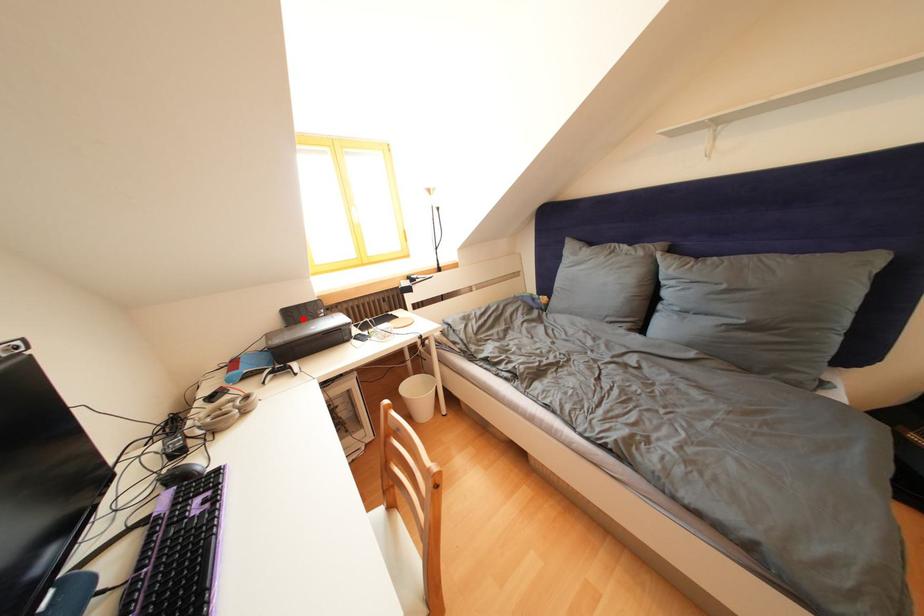
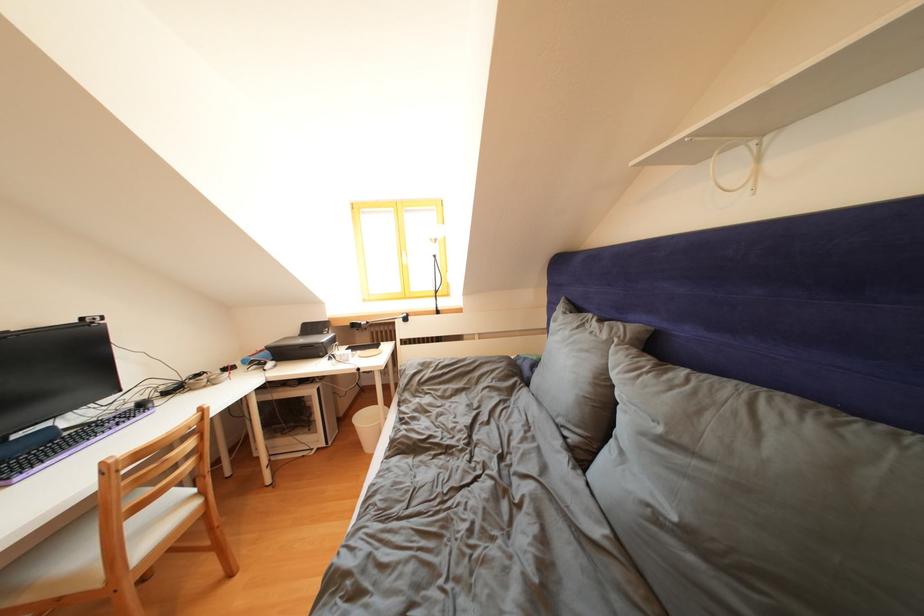
The point at the highlighted location is marked in the first image. Where is the corresponding point in the second image?

(319, 333)